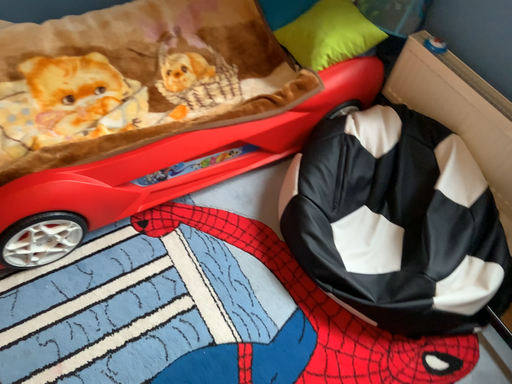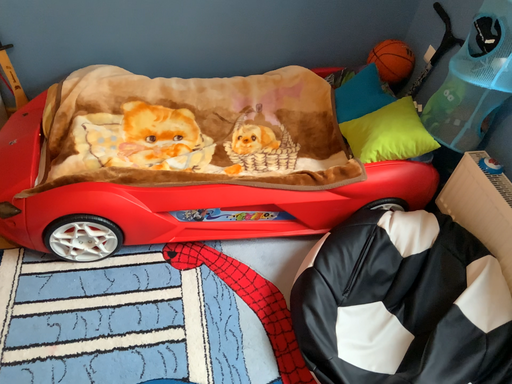
Question: Which way did the camera rotate in the video?

Choices:
 (A) rotated right
 (B) rotated left

Answer: (B)